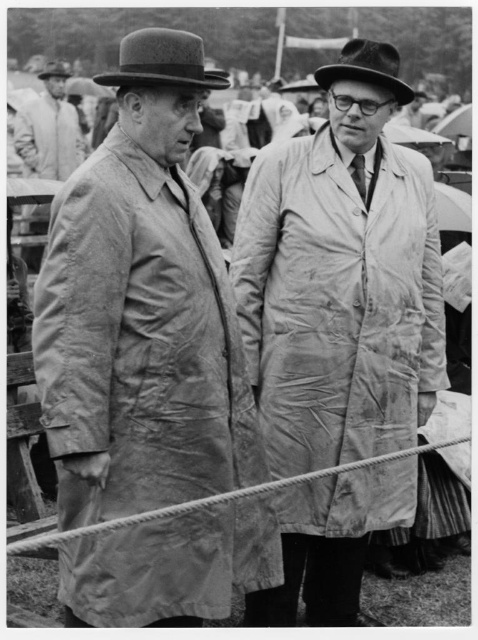
You are a photographer trying to capture a closeup of the man on the left. You notice a point at coordinates [337,300] in the image. Based on the scene description, can you determine what object this point is located on?

The point at coordinates [337,300] is located on the worn beige fabric raincoat at center.

You are a photographer trying to capture a clear shot of the two men in the scene. The matte black hat at upper left and the matte black hat at upper right are both in your viewfinder. Which hat is positioned lower in the frame?

The matte black hat at upper left is positioned lower in the frame than the matte black hat at upper right.

You are a photographer trying to capture a clear photo of both the matte black hat at upper left and the matte black hat at upper right. Given that your camera can focus on objects within a 36 inch range, will both hats be in focus?

The distance between the matte black hat at upper left and the matte black hat at upper right is 37.01 inches, which exceeds the camera focus range of 36 inches. Therefore, both hats cannot be in focus simultaneously.